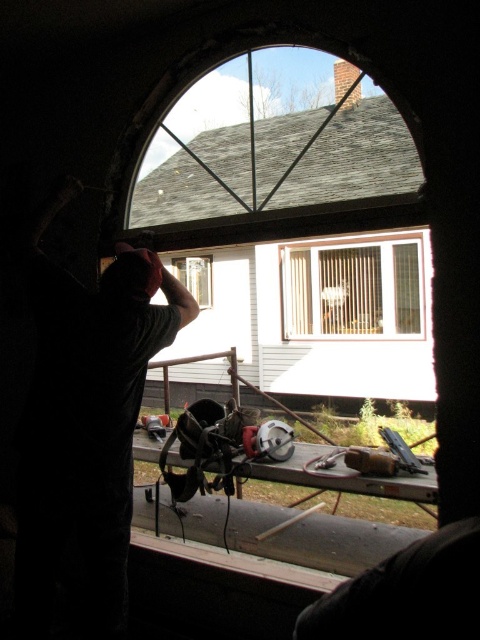
You are standing in a room with an arched window. You notice a point marked at coordinates (85, 420). Based on the scene, which object does this point correspond to?

The point at (85, 420) corresponds to the dark gray t shirt at left.

You are standing in a room and want to look through the white textured window at center. Where should you position yourself to see it clearly?

The white textured window at center is located at coordinates 0.453 on the x axis and 0.733 on the y axis, so you should position yourself directly in front of that point to see it clearly.